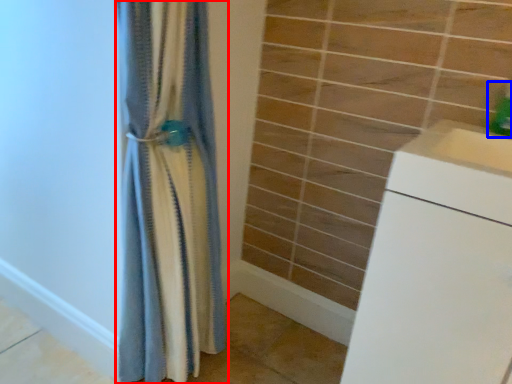
Question: Which object appears closest to the camera in this image, curtain (highlighted by a red box) or soap dispenser (highlighted by a blue box)?

Choices:
 (A) curtain
 (B) soap dispenser

Answer: (A)